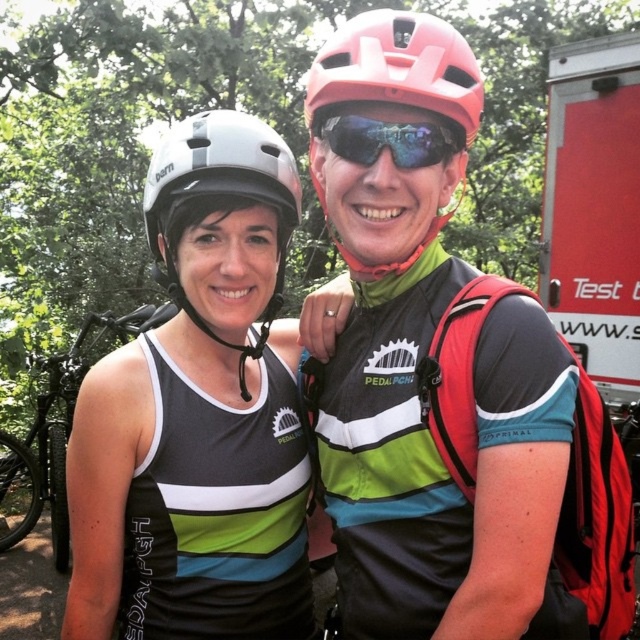
You are a photographer trying to capture both the white matte helmet at upper left and the matte pink helmet at upper center in a single shot. Based on their positions, which helmet will appear closer to the camera in the photo?

The white matte helmet at upper left is further to the viewer than the matte pink helmet at upper center, so it will appear closer to the camera in the photo.